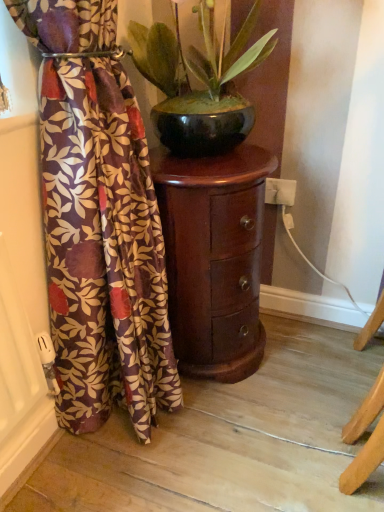
Question: Is glossy ceramic pot at center in front of or behind mahogany wood side table at center in the image?

Choices:
 (A) front
 (B) behind

Answer: (A)

Question: From the image's perspective, relative to mahogany wood side table at center, is glossy ceramic pot at center above or below?

Choices:
 (A) below
 (B) above

Answer: (B)

Question: Which object is the closest to the mahogany wood side table at center?

Choices:
 (A) glossy ceramic pot at center
 (B) velvet floral curtain at left

Answer: (B)

Question: Based on their relative distances, which object is nearer to the glossy ceramic pot at center?

Choices:
 (A) velvet floral curtain at left
 (B) mahogany wood side table at center

Answer: (B)